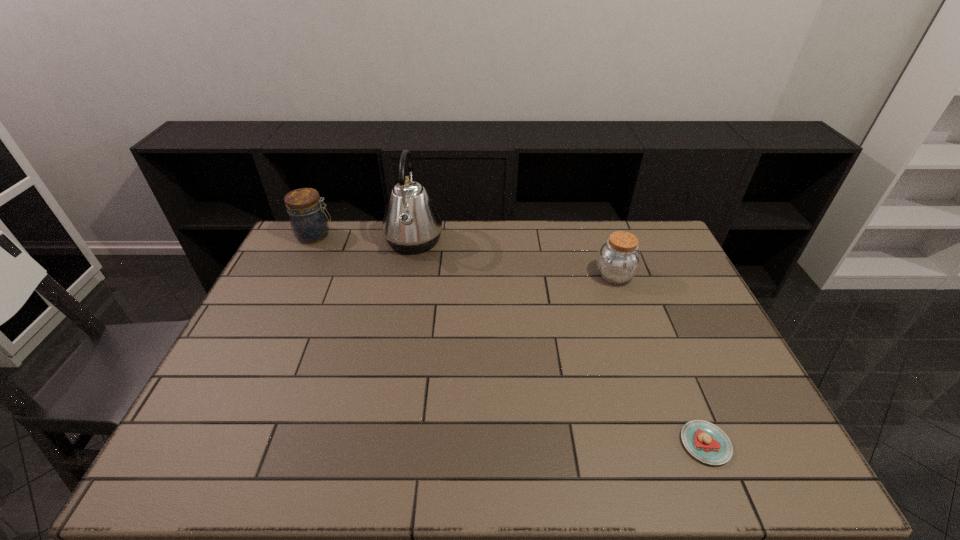
The width and height of the screenshot is (960, 540). In order to click on the tallest object in this screenshot , I will do `click(411, 224)`.

Locate an element on the screen. Image resolution: width=960 pixels, height=540 pixels. the third object from right to left is located at coordinates (411, 224).

You are a GUI agent. You are given a task and a screenshot of the screen. Output one action in this format:
    pyautogui.click(x=<x>, y=<y>)
    Task: Click on the farther jar
    The image size is (960, 540).
    Given the screenshot: What is the action you would take?
    pyautogui.click(x=309, y=223)

The image size is (960, 540). I want to click on the left jar, so click(309, 223).

Identify the location of the right jar. Image resolution: width=960 pixels, height=540 pixels. (618, 260).

Find the location of `the nearer jar`. the nearer jar is located at coordinates (618, 260).

Find the location of a particular element. Image resolution: width=960 pixels, height=540 pixels. the nearest object is located at coordinates (705, 441).

At what (x,y) coordinates should I click in order to perform the action: click on the shortest object. Please return your answer as a coordinate pair (x, y). The width and height of the screenshot is (960, 540). Looking at the image, I should click on (705, 441).

Find the location of `free location located 0.250m from the spout of the second object from left to right`. free location located 0.250m from the spout of the second object from left to right is located at coordinates (512, 241).

Where is `vacant area situated 0.280m on the lid of the left jar`? This screenshot has height=540, width=960. vacant area situated 0.280m on the lid of the left jar is located at coordinates (409, 235).